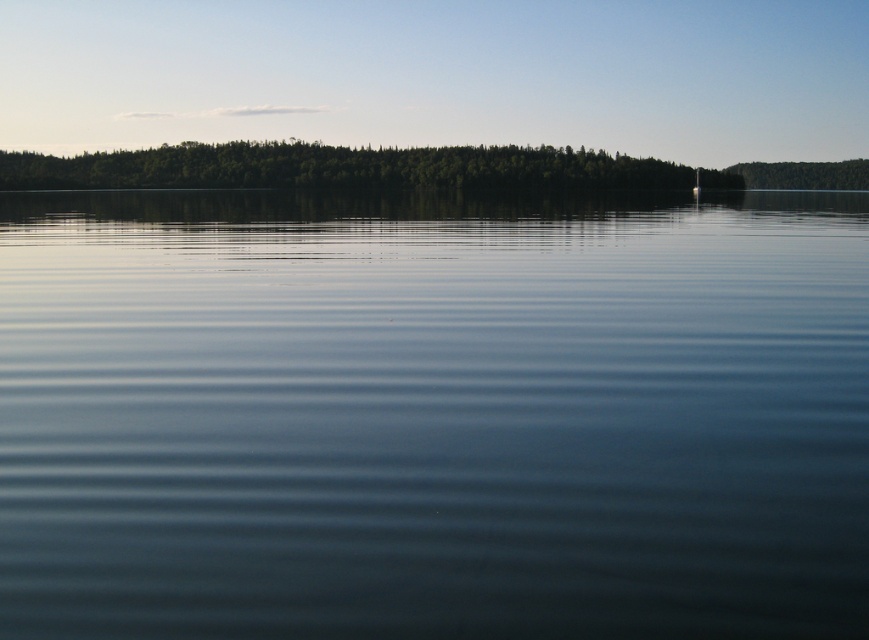
Does transparent water at center appear on the right side of green leafy trees at upper center?

Correct, you'll find transparent water at center to the right of green leafy trees at upper center.

Which is behind, point (121, 513) or point (138, 173)?

Positioned behind is point (138, 173).

At what (x,y) coordinates should I click in order to perform the action: click on transparent water at center. Please return your answer as a coordinate pair (x, y). Looking at the image, I should click on (432, 413).